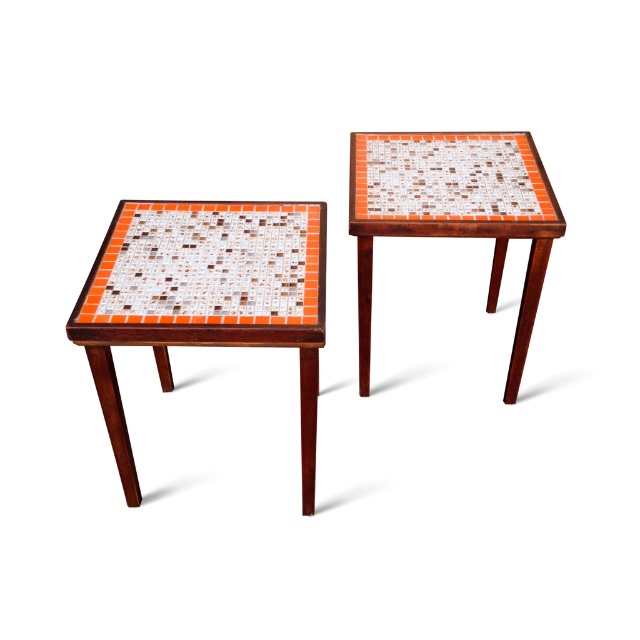
The height and width of the screenshot is (640, 640). What do you see at coordinates (205, 298) in the screenshot?
I see `mosaic tile table at left` at bounding box center [205, 298].

Does mosaic tile table at left have a lesser width compared to orange mosaic tile at left?

Incorrect, mosaic tile table at left's width is not less than orange mosaic tile at left's.

Is point (288, 253) behind point (250, 268)?

Yes, it is.

Where is `mosaic tile table at left`? The width and height of the screenshot is (640, 640). mosaic tile table at left is located at coordinates (205, 298).

Which is more to the right, mosaic tile table at left or orange mosaic tile side table at upper right?

orange mosaic tile side table at upper right

Does mosaic tile table at left have a smaller size compared to orange mosaic tile side table at upper right?

Yes.

Does point (234, 268) lie behind point (451, 193)?

That is False.

This screenshot has height=640, width=640. Identify the location of mosaic tile table at left. (205, 298).

Can you confirm if orange mosaic tile at left is smaller than orange mosaic tile side table at upper right?

Correct, orange mosaic tile at left occupies less space than orange mosaic tile side table at upper right.

Is point (285, 218) more distant than point (528, 170)?

No, (285, 218) is in front of (528, 170).

Which is behind, point (193, 276) or point (554, 202)?

The point (554, 202) is behind.

Find the location of `orange mosaic tile at left`. orange mosaic tile at left is located at coordinates (209, 264).